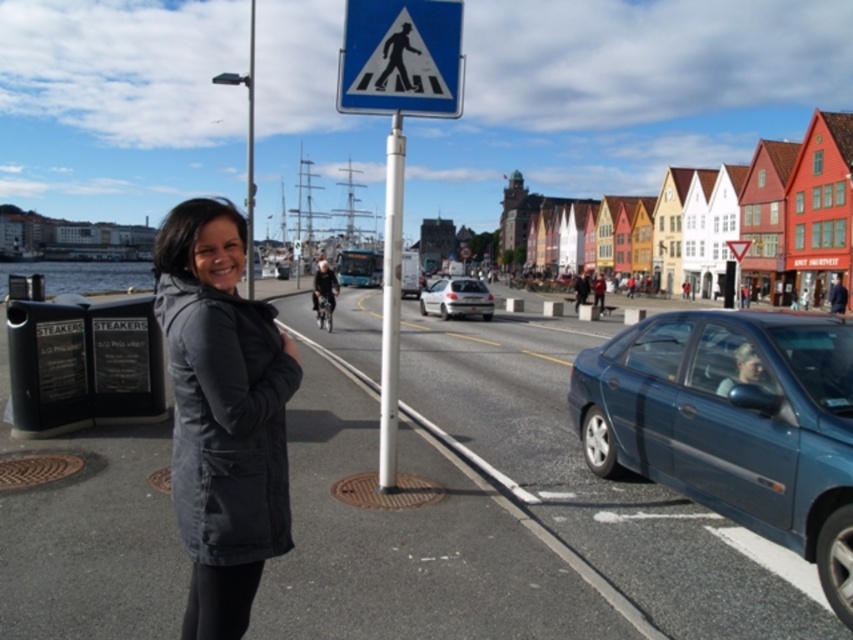
Is white smooth pole at center positioned before metallic pole at center?

No, it is not.

Which is behind, point (397, 177) or point (250, 145)?

Point (250, 145)

Where is `white smooth pole at center`? The image size is (853, 640). white smooth pole at center is located at coordinates tap(390, 305).

Is blue plastic pedestrian crossing sign at upper center shorter than dark gray jacket at center?

No, blue plastic pedestrian crossing sign at upper center is not shorter than dark gray jacket at center.

Can you confirm if blue plastic pedestrian crossing sign at upper center is positioned to the right of dark gray jacket at center?

Correct, you'll find blue plastic pedestrian crossing sign at upper center to the right of dark gray jacket at center.

Which is behind, point (381, 100) or point (331, 282)?

The point (331, 282) is behind.

Identify the location of blue plastic pedestrian crossing sign at upper center. The image size is (853, 640). (401, 58).

Can you confirm if dark gray fabric jacket at left is shorter than blue plastic pedestrian crossing sign at upper center?

Indeed, dark gray fabric jacket at left has a lesser height compared to blue plastic pedestrian crossing sign at upper center.

Which is in front, point (225, 493) or point (351, 48)?

Positioned in front is point (225, 493).

Measure the distance between dark gray fabric jacket at left and camera.

They are 7.93 feet apart.

You are a GUI agent. You are given a task and a screenshot of the screen. Output one action in this format:
    pyautogui.click(x=<x>, y=<y>)
    Task: Click on the dark gray fabric jacket at left
    
    Given the screenshot: What is the action you would take?
    pyautogui.click(x=222, y=413)